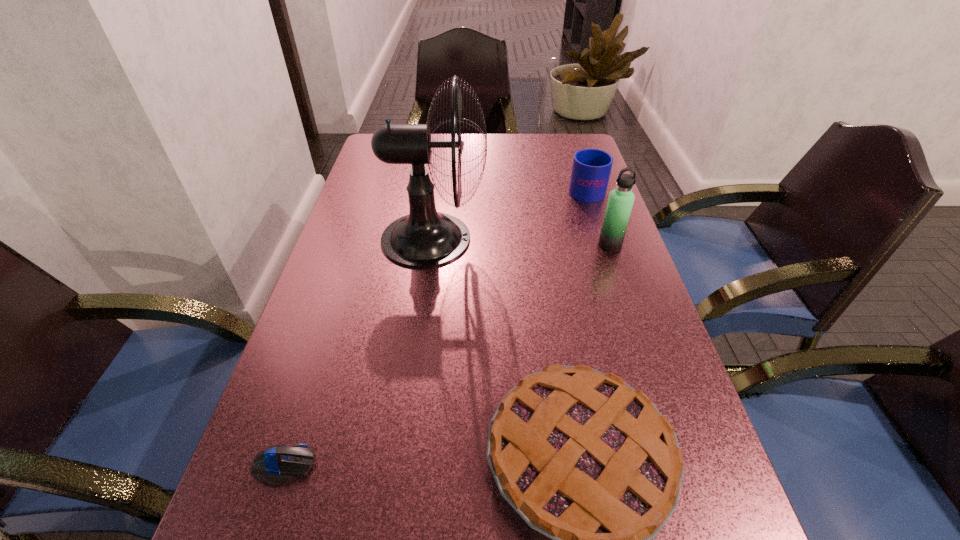
Where is `free region located 0.290m on the side with the handle of the third tallest object`? The width and height of the screenshot is (960, 540). free region located 0.290m on the side with the handle of the third tallest object is located at coordinates (568, 134).

Find the location of a particular element. Image resolution: width=960 pixels, height=540 pixels. vacant space situated 0.240m on the button side of the leftmost object is located at coordinates (464, 465).

This screenshot has height=540, width=960. Identify the location of fan that is positioned at the left edge. (425, 238).

Locate an element on the screen. The image size is (960, 540). computer mouse that is positioned at the left edge is located at coordinates (277, 465).

Locate an element on the screen. thermos bottle positioned at the right edge is located at coordinates (620, 202).

Identify the location of mug that is at the right edge. The image size is (960, 540). (591, 168).

Locate an element on the screen. This screenshot has width=960, height=540. free region at the left edge of the desktop is located at coordinates (384, 218).

Image resolution: width=960 pixels, height=540 pixels. In order to click on vacant area at the right edge of the desktop in this screenshot , I will do [597, 300].

Image resolution: width=960 pixels, height=540 pixels. In the image, there is a desktop. Find the location of `vacant space at the far right corner`. vacant space at the far right corner is located at coordinates 587,147.

Locate an element on the screen. This screenshot has height=540, width=960. vacant area that lies between the thermos bottle and the fan is located at coordinates (522, 242).